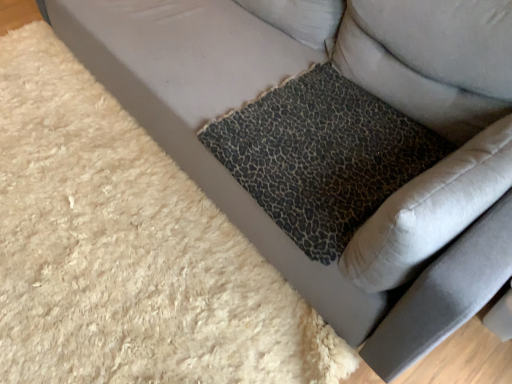
Describe the element at coordinates (430, 211) in the screenshot. Image resolution: width=512 pixels, height=384 pixels. I see `leopard print cushion at lower right` at that location.

Find the location of a particular element. leopard print fabric cushion at center is located at coordinates (321, 156).

Looking at their sizes, would you say leopard print fabric cushion at center is wider or thinner than leopard print fabric pillow at upper right?

leopard print fabric cushion at center is wider than leopard print fabric pillow at upper right.

Does point (317, 125) appear closer or farther from the camera than point (498, 13)?

Point (317, 125) is farther from the camera than point (498, 13).

From a real-world perspective, between leopard print fabric cushion at center and leopard print fabric pillow at upper right, who is vertically higher?

From a 3D spatial view, leopard print fabric pillow at upper right is above.

From the image's perspective, is leopard print fabric cushion at center under leopard print fabric pillow at upper right?

Yes, from the image's perspective, leopard print fabric cushion at center is beneath leopard print fabric pillow at upper right.

Is the surface of leopard print fabric pillow at upper right in direct contact with leopard print cushion at lower right?

No, leopard print fabric pillow at upper right is not with leopard print cushion at lower right.

How different are the orientations of leopard print fabric pillow at upper right and leopard print cushion at lower right in degrees?

leopard print fabric pillow at upper right and leopard print cushion at lower right are facing 90.6 degrees away from each other.

From the image's perspective, is leopard print fabric pillow at upper right positioned above or below leopard print cushion at lower right?

leopard print fabric pillow at upper right is situated higher than leopard print cushion at lower right in the image.

Does leopard print fabric pillow at upper right come behind leopard print cushion at lower right?

Yes, leopard print fabric pillow at upper right is behind leopard print cushion at lower right.

Where is `swivel chair in front of the leopard print fabric cushion at center`? swivel chair in front of the leopard print fabric cushion at center is located at coordinates (430, 211).

Is leopard print cushion at lower right next to leopard print fabric cushion at center?

No, leopard print cushion at lower right is not beside leopard print fabric cushion at center.

What's the angular difference between leopard print cushion at lower right and leopard print fabric cushion at center's facing directions?

89.7 degrees separate the facing orientations of leopard print cushion at lower right and leopard print fabric cushion at center.

Relative to leopard print fabric pillow at upper right, is leopard print cushion at lower right in front or behind?

Clearly, leopard print cushion at lower right is in front of leopard print fabric pillow at upper right.

From the image's perspective, which one is positioned higher, leopard print cushion at lower right or leopard print fabric pillow at upper right?

leopard print fabric pillow at upper right.

Which of these two, leopard print cushion at lower right or leopard print fabric pillow at upper right, is bigger?

leopard print fabric pillow at upper right.

Between leopard print cushion at lower right and leopard print fabric pillow at upper right, which one has less height?

leopard print cushion at lower right.

From a real-world perspective, is leopard print fabric cushion at center physically located above or below leopard print cushion at lower right?

From a real-world perspective, leopard print fabric cushion at center is physically below leopard print cushion at lower right.

Would you say leopard print fabric cushion at center contains leopard print cushion at lower right?

Definitely not — leopard print cushion at lower right is not inside leopard print fabric cushion at center.

Looking at this image, who is bigger, leopard print fabric cushion at center or leopard print cushion at lower right?

With larger size is leopard print cushion at lower right.

Is leopard print fabric cushion at center far away from leopard print cushion at lower right?

No, leopard print fabric cushion at center is in close proximity to leopard print cushion at lower right.

Is leopard print fabric pillow at upper right to the left or to the right of leopard print fabric cushion at center in the image?

Based on their positions, leopard print fabric pillow at upper right is located to the right of leopard print fabric cushion at center.

Consider the image. Which of these two, leopard print fabric pillow at upper right or leopard print fabric cushion at center, is wider?

Wider between the two is leopard print fabric cushion at center.

Can leopard print fabric cushion at center be found inside leopard print fabric pillow at upper right?

Actually, leopard print fabric cushion at center is outside leopard print fabric pillow at upper right.

The image size is (512, 384). Identify the location of cat bed directly beneath the leopard print fabric pillow at upper right (from a real-world perspective). (321, 156).

You are a GUI agent. You are given a task and a screenshot of the screen. Output one action in this format:
    pyautogui.click(x=<x>, y=<y>)
    Task: Click on the pillow on the right of leopard print cushion at lower right
    
    Given the screenshot: What is the action you would take?
    pyautogui.click(x=432, y=59)

From the image, which object appears to be farther from leopard print fabric cushion at center, leopard print cushion at lower right or leopard print fabric pillow at upper right?

leopard print cushion at lower right.

Considering their positions, is leopard print cushion at lower right positioned closer to leopard print fabric pillow at upper right than leopard print fabric cushion at center?

Based on the image, leopard print fabric cushion at center appears to be nearer to leopard print fabric pillow at upper right.

When comparing their distances from leopard print cushion at lower right, does leopard print fabric cushion at center or leopard print fabric pillow at upper right seem closer?

leopard print fabric cushion at center lies closer to leopard print cushion at lower right than the other object.

Based on their spatial positions, is leopard print fabric cushion at center or leopard print cushion at lower right further from leopard print fabric pillow at upper right?

Among the two, leopard print cushion at lower right is located further to leopard print fabric pillow at upper right.

From the image, which object appears to be nearer to leopard print fabric cushion at center, leopard print fabric pillow at upper right or leopard print cushion at lower right?

leopard print fabric pillow at upper right is closer to leopard print fabric cushion at center.

Estimate the real-world distances between objects in this image. Which object is closer to leopard print cushion at lower right, leopard print fabric pillow at upper right or leopard print fabric cushion at center?

leopard print fabric cushion at center is positioned closer to the anchor leopard print cushion at lower right.

The height and width of the screenshot is (384, 512). In order to click on cat bed between leopard print fabric pillow at upper right and leopard print cushion at lower right in the up-down direction in this screenshot , I will do `click(321, 156)`.